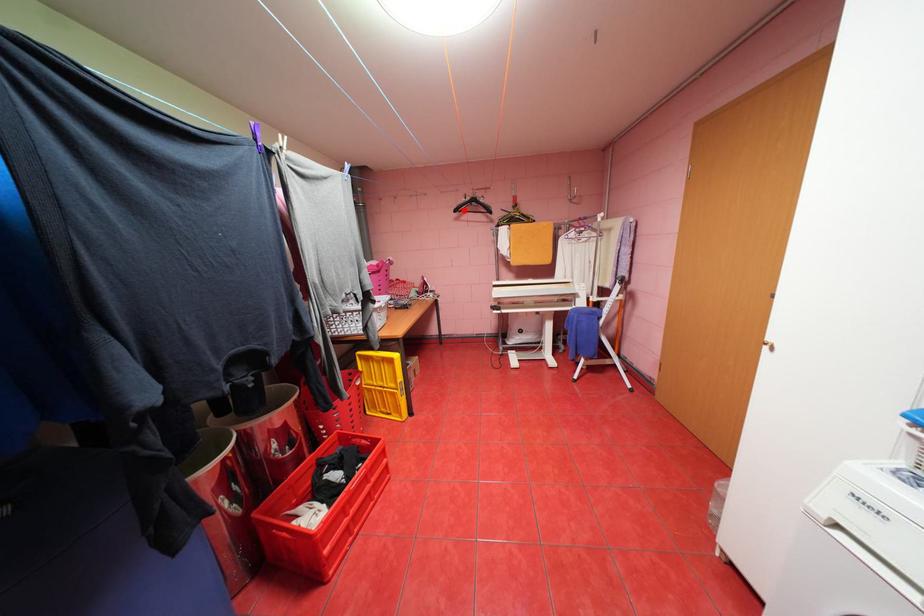
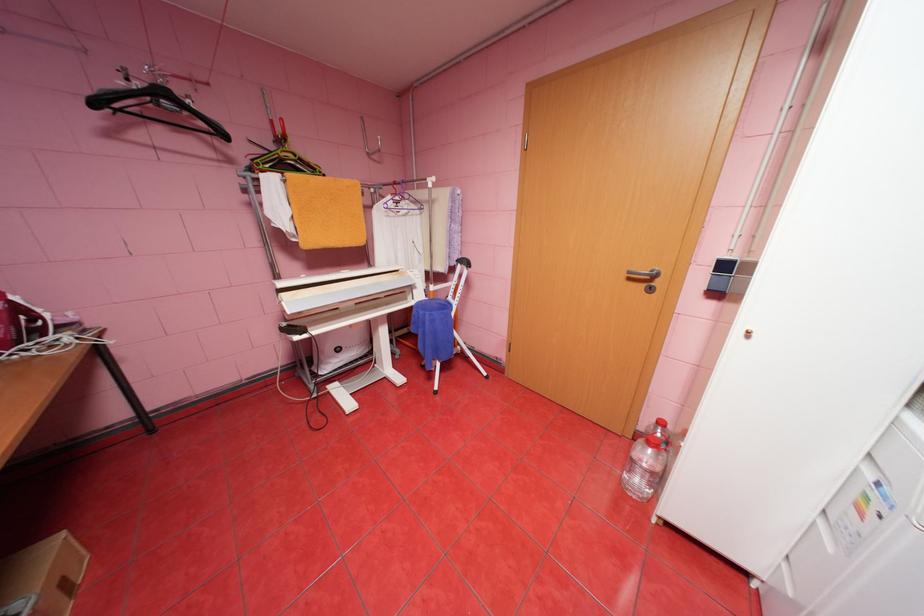
Question: I am providing you with two images of the same scene from different viewpoints. Image1 has a red point marked. In image2, the corresponding 3D location appears at what relative position? Reply with the corresponding letter.

Choices:
 (A) Closer
 (B) Farther

Answer: (B)